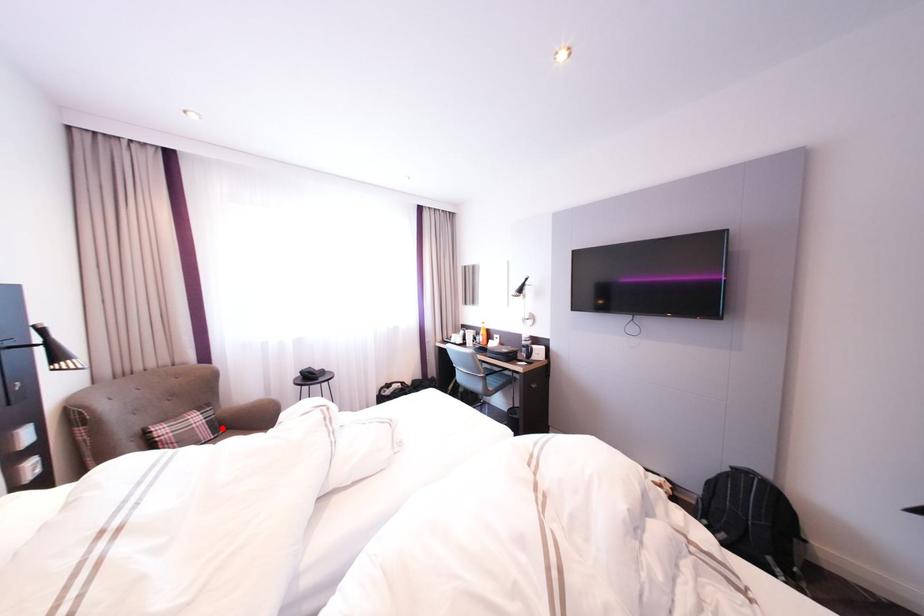
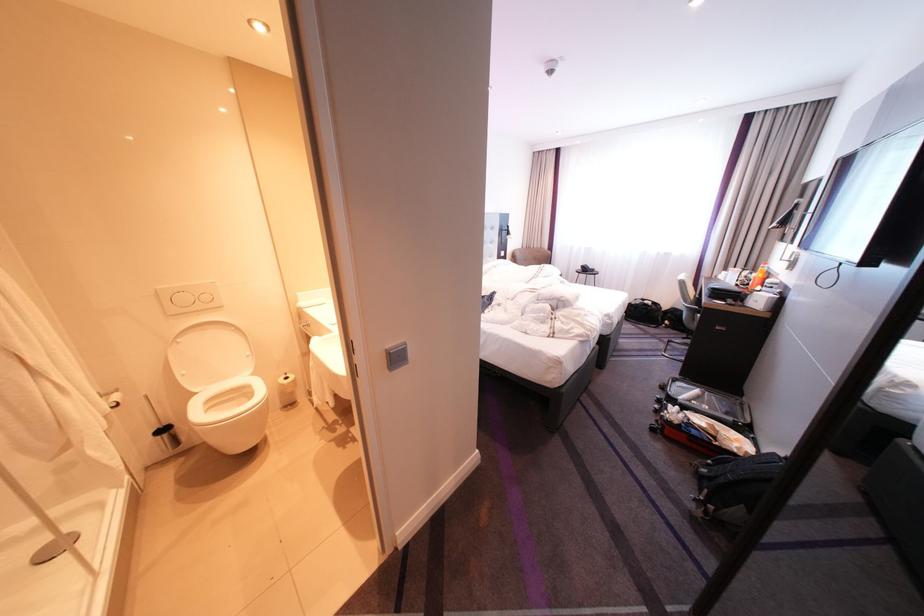
Question: I am providing you with two images of the same scene from different viewpoints. A red point is marked on the first image. At the location where the point appears in image 1, is it still visible in image 2?

Choices:
 (A) Yes
 (B) No

Answer: (B)